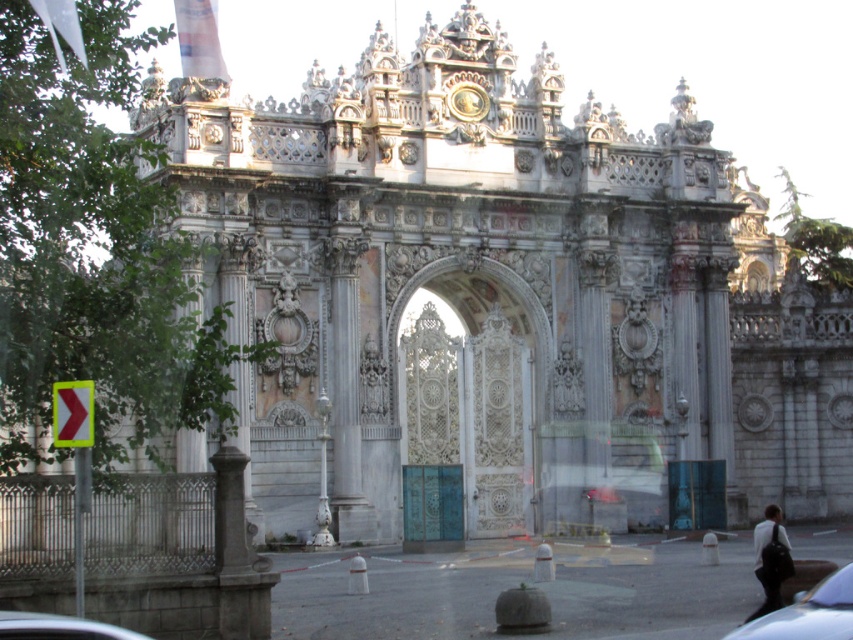
Is white marble archway at center bigger than dark gray fabric bag at lower right?

Yes.

Between white marble archway at center and dark gray fabric bag at lower right, which one appears on the left side from the viewer's perspective?

white marble archway at center is more to the left.

This screenshot has height=640, width=853. Identify the location of white marble archway at center. (469, 416).

Is white glossy car at lower right shorter than dark gray fabric bag at lower right?

Indeed, white glossy car at lower right has a lesser height compared to dark gray fabric bag at lower right.

Is white glossy car at lower right closer to the viewer compared to dark gray fabric bag at lower right?

That is True.

Locate an element on the screen. white glossy car at lower right is located at coordinates (808, 612).

Locate an element on the screen. The height and width of the screenshot is (640, 853). white glossy car at lower right is located at coordinates (808, 612).

In the scene shown: Does white glossy car at lower left have a greater height compared to dark gray fabric bag at lower right?

In fact, white glossy car at lower left may be shorter than dark gray fabric bag at lower right.

Who is more forward, (x=96, y=630) or (x=759, y=576)?

Positioned in front is point (x=96, y=630).

The height and width of the screenshot is (640, 853). Describe the element at coordinates (57, 627) in the screenshot. I see `white glossy car at lower left` at that location.

The image size is (853, 640). What are the coordinates of `white glossy car at lower left` in the screenshot? It's located at (57, 627).